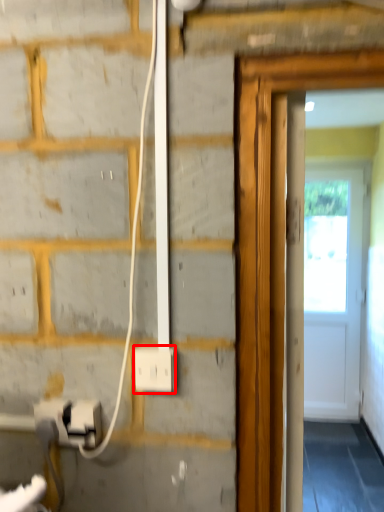
Question: From the image's perspective, what is the correct spatial relationship of power plugs and sockets (annotated by the red box) in relation to electric outlet?

Choices:
 (A) above
 (B) below

Answer: (A)